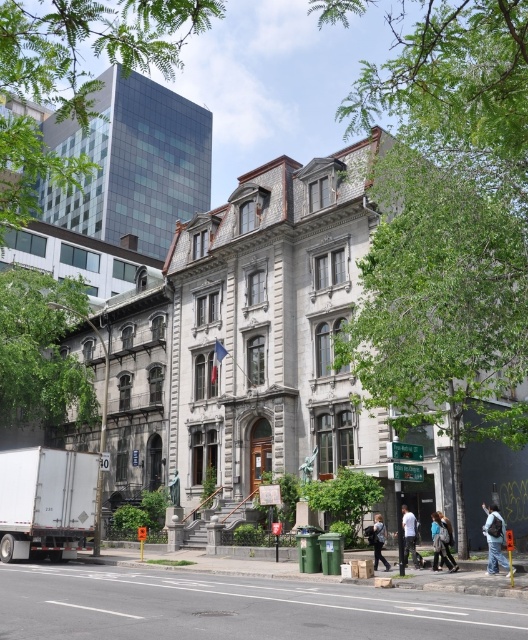
You are a photographer planning to take a photo of the historic building. You notice the light blue jeans at center and the light brown leather jacket at lower center in the foreground. Which object should you adjust to ensure they are both in focus, considering their sizes and positions?

The light blue jeans at center is taller than the light brown leather jacket at lower center. To ensure both are in focus, adjust the camera to focus on the light blue jeans at center since it is the taller object and occupies more space in the foreground.

You are a photographer planning to capture a photo of the historic building. You want to ensure that both the blue denim jeans at lower right and the light brown leather jacket at lower center are visible in the frame. Based on their positions, which object should be closer to the camera?

The blue denim jeans at lower right is in front of the light brown leather jacket at lower center, so the blue denim jeans at lower right will be closer to the camera.

You are a visitor approaching the historic building and notice two items on the steps leading to the entrance. The items are the light blue jeans at center and the light brown leather jacket at lower center. Which item is positioned higher up the steps?

The light blue jeans at center is positioned higher up the steps because it is above the light brown leather jacket at lower center.